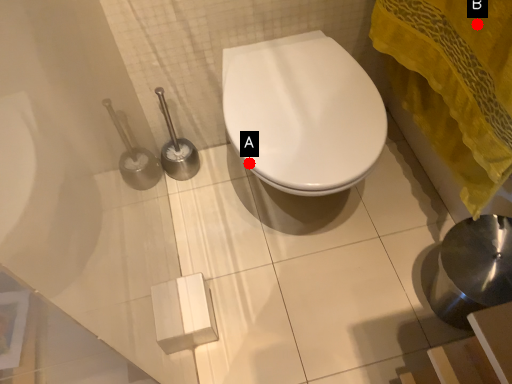
Question: Two points are circled on the image, labeled by A and B beside each circle. Which of the following is the farthest from the observer?

Choices:
 (A) A is further
 (B) B is further

Answer: (A)